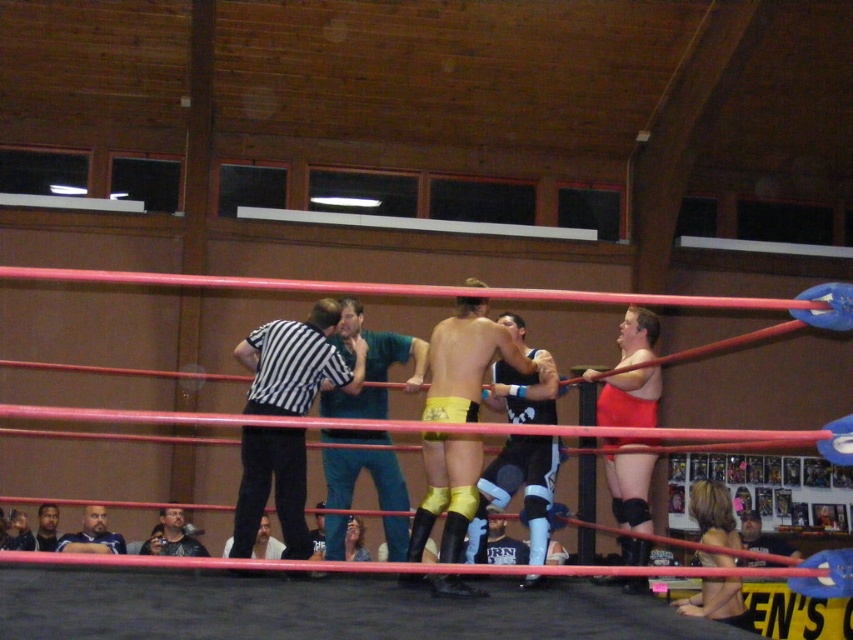
In the gymnasium scene, there are two referees wearing a teal fabric shirt at center and a dark blue shirt at lower left. Which referee is positioned to the right of the other?

The teal fabric shirt at center is positioned to the right of the dark blue shirt at lower left.

You are a photographer standing in the gymnasium and want to take a photo of the wrestling match. You notice two points marked in the scene. Which point, point 1 at coordinates (380,435) or point 2 at coordinates (88,518), is closer to you?

Point 1 at coordinates (380,435) is closer to you than point 2 at coordinates (88,518).

You are a spectator at the wrestling match. You notice two people in the ring wearing a black striped shirt at center and a dark blue shirt at lower left. Which one is positioned higher in the image?

The black striped shirt at center is positioned higher than the dark blue shirt at lower left in the image.